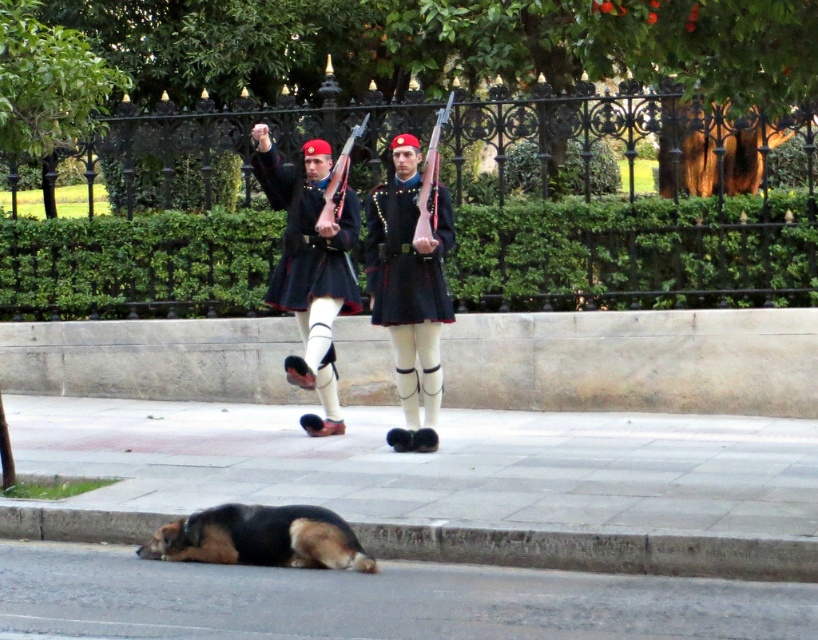
You are a photographer standing at the edge of the sidewalk. You want to take a photo of the dark blue uniform at center so that it appears larger than the brown asphalt at lower center in the image. Based on their positions, is this possible?

The brown asphalt at lower center has a lesser height compared to the dark blue uniform at center. Since the asphalt is lower, positioning the camera closer to the dark blue uniform at center would make it appear larger in the photo compared to the brown asphalt at lower center.

You are standing at the point marked by the coordinates point (596,550). Looking around, you see the gray concrete curb at lower center. Which direction should you walk to reach the two uniformed guards marching in formation on a paved sidewalk?

The gray concrete curb at lower center is located at point (596,550). Since the guards are marching on the paved sidewalk, you should walk towards the direction where the sidewalk is located, which is likely north or towards the upper part of the image.